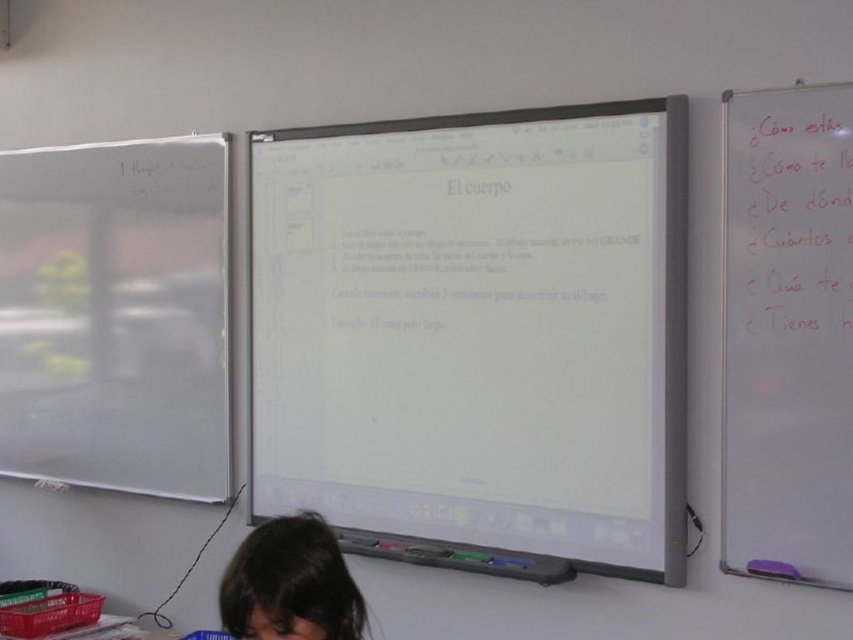
In the scene shown: Is white glossy projector screen at center closer to camera compared to dark brown hair at lower center?

No.

Between white glossy projector screen at center and dark brown hair at lower center, which one is positioned higher?

white glossy projector screen at center is above.

Identify the location of white glossy projector screen at center. This screenshot has width=853, height=640. (476, 337).

Who is more forward, (825, 314) or (335, 554)?

Point (335, 554) is in front.

Who is taller, whiteboard at right or dark brown hair at lower center?

whiteboard at right is taller.

Locate an element on the screen. Image resolution: width=853 pixels, height=640 pixels. whiteboard at right is located at coordinates (786, 333).

Find the location of `whiteboard at right`. whiteboard at right is located at coordinates (786, 333).

Who is more forward, (730, 243) or (105, 628)?

Point (730, 243)

Does whiteboard at right have a lesser height compared to plastic crate at lower left?

Incorrect, whiteboard at right's height does not fall short of plastic crate at lower left's.

This screenshot has width=853, height=640. What are the coordinates of `whiteboard at right` in the screenshot? It's located at (786, 333).